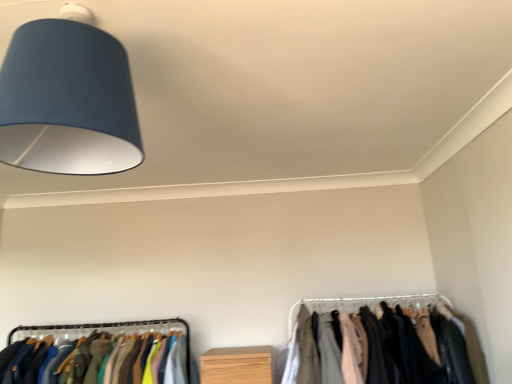
Question: In the image, is silky fabric clothes at lower right positioned in front of or behind matte blue lampshade at upper left?

Choices:
 (A) front
 (B) behind

Answer: (B)

Question: Visually, is silky fabric clothes at lower right positioned to the left or to the right of matte blue lampshade at upper left?

Choices:
 (A) left
 (B) right

Answer: (B)

Question: In terms of width, does silky fabric clothes at lower right look wider or thinner when compared to matte blue lampshade at upper left?

Choices:
 (A) wide
 (B) thin

Answer: (A)

Question: In terms of size, does matte blue lampshade at upper left appear bigger or smaller than silky fabric clothes at lower right?

Choices:
 (A) small
 (B) big

Answer: (A)

Question: From the image's perspective, relative to silky fabric clothes at lower right, is matte blue lampshade at upper left above or below?

Choices:
 (A) below
 (B) above

Answer: (B)

Question: Is matte blue lampshade at upper left spatially inside silky fabric clothes at lower right, or outside of it?

Choices:
 (A) outside
 (B) inside

Answer: (A)

Question: From a real-world perspective, is matte blue lampshade at upper left positioned above or below silky fabric clothes at lower right?

Choices:
 (A) below
 (B) above

Answer: (B)